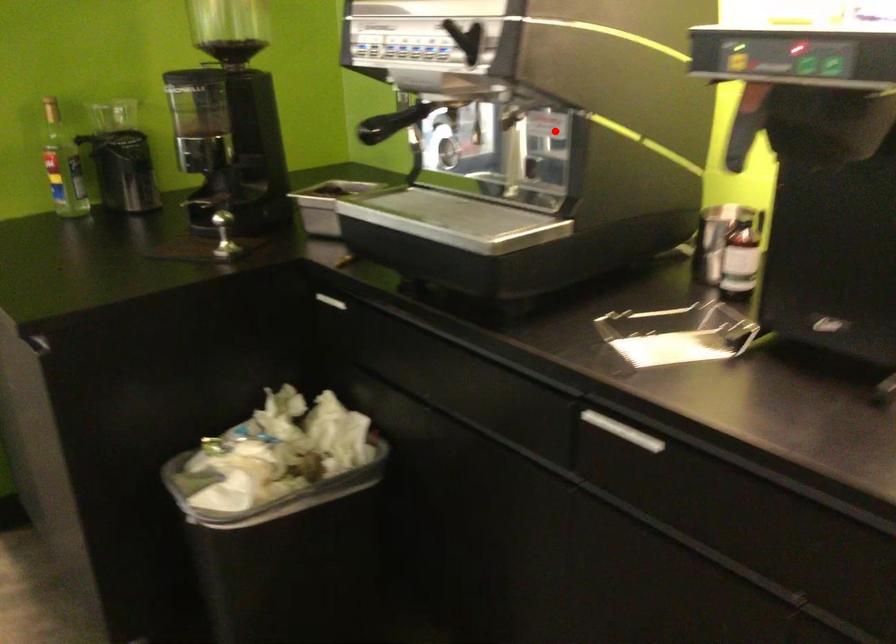
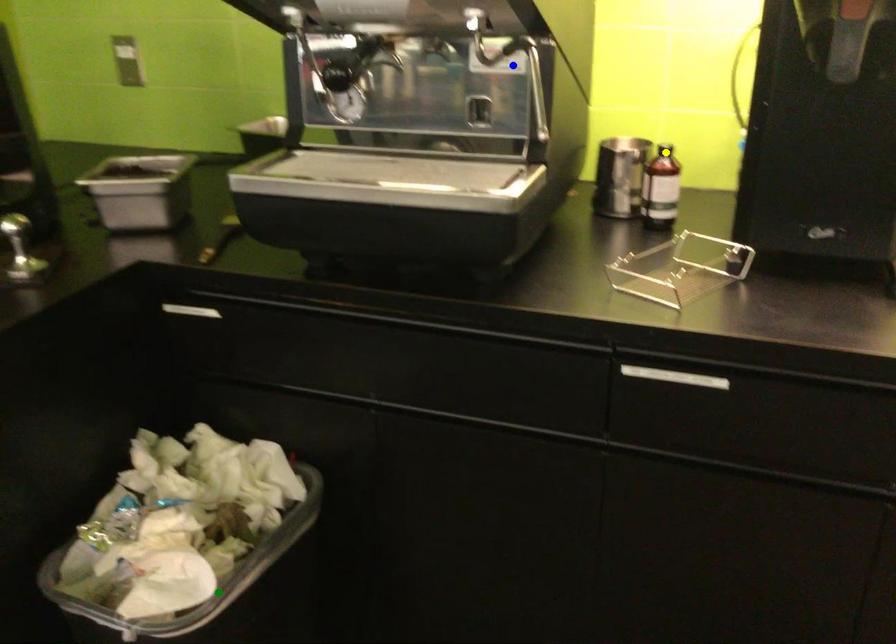
Question: I am providing you with two images of the same scene from different viewpoints. A red point is marked on the first image. You are given multiple points on the second image. Which point in image 2 represents the same 3d spot as the red point in image 1?

Choices:
 (A) green point
 (B) blue point
 (C) yellow point

Answer: (B)